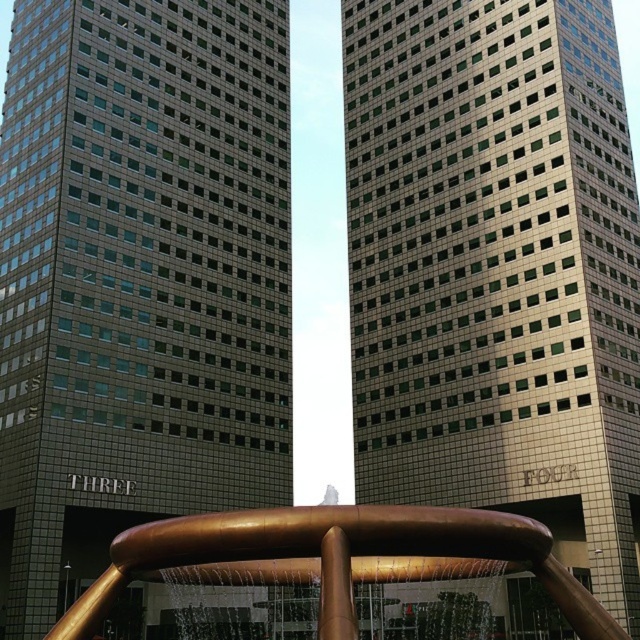
You are an architect designing a new plaza between the satin gold glass tower at center and the gold polished water at center. The city requires that the plaza must be at least 20 meters wide to accommodate public events. Can the plaza fit between them based on their widths?

The satin gold glass tower at center is wider than the gold polished water at center. However, without specific measurements of their widths, it is impossible to determine if the plaza can fit between them. The city might need more precise data to proceed.

You are standing at the base of the satin gold glass tower at center. You want to take a photo of the tower with the two modern skyscrapers in the background. Since the two modern skyscrapers are behind the tower, will they be visible in your photo?

The satin gold glass tower at center is 53.16 meters away from viewer. Since the two modern skyscrapers are behind the tower, they may still be partially visible in the photo depending on the camera angle and zoom, but their full view might be obstructed by the tower.

You are standing at the base of the skyscrapers and looking towards the golden sculpture. There are two points marked in the image. Which point, point (602, 449) or point (108, 611), is closer to your line of sight?

Point (108, 611) is closer to your line of sight because it is in front of point (602, 449).